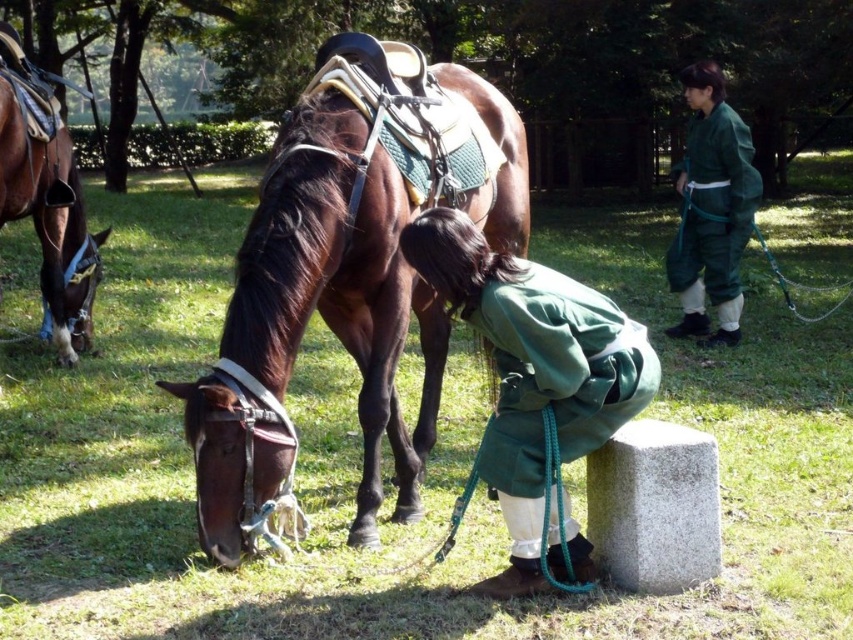
Question: Based on their relative distances, which object is farther from the green fabric kimono at upper right?

Choices:
 (A) green soft robe at center
 (B) brown leather saddle at left
 (C) shiny brown horse at center

Answer: (B)

Question: Can you confirm if shiny brown horse at center is thinner than green soft robe at center?

Choices:
 (A) yes
 (B) no

Answer: (B)

Question: Is shiny brown horse at center wider than green fabric kimono at upper right?

Choices:
 (A) no
 (B) yes

Answer: (B)

Question: Which object is positioned farthest from the shiny brown horse at center?

Choices:
 (A) green fabric kimono at upper right
 (B) green soft robe at center

Answer: (A)

Question: Which of the following is the closest to the observer?

Choices:
 (A) green soft robe at center
 (B) shiny brown horse at center
 (C) brown leather saddle at left
 (D) green fabric kimono at upper right

Answer: (A)

Question: Does shiny brown horse at center appear over green soft robe at center?

Choices:
 (A) yes
 (B) no

Answer: (A)